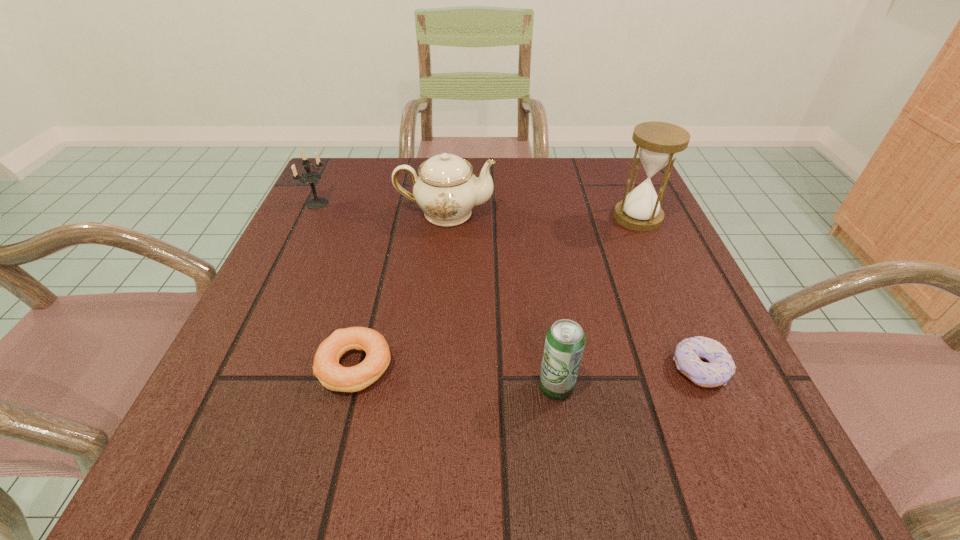
Identify the location of free space that satisfies the following two spatial constraints: 1. on the back side of the hourglass; 2. on the right side of the doughnut. This screenshot has height=540, width=960. (634, 217).

You are a GUI agent. You are given a task and a screenshot of the screen. Output one action in this format:
    pyautogui.click(x=<x>, y=<y>)
    Task: Click on the blank area in the image that satisfies the following two spatial constraints: 1. on the front side of the candle holder; 2. on the right side of the hourglass
    Image resolution: width=960 pixels, height=540 pixels.
    Given the screenshot: What is the action you would take?
    pyautogui.click(x=311, y=217)

Identify the location of vacant space that satisfies the following two spatial constraints: 1. at the spout of the chinaware; 2. on the right side of the tallest object. The width and height of the screenshot is (960, 540). (445, 217).

This screenshot has width=960, height=540. Identify the location of vacant region that satisfies the following two spatial constraints: 1. on the front side of the candle holder; 2. on the right side of the bagel. (240, 366).

You are a GUI agent. You are given a task and a screenshot of the screen. Output one action in this format:
    pyautogui.click(x=<x>, y=<y>)
    Task: Click on the free spot that satisfies the following two spatial constraints: 1. at the spout of the chinaware; 2. on the right side of the hourglass
    
    Given the screenshot: What is the action you would take?
    [x=445, y=217]

Identify the location of vacant point that satisfies the following two spatial constraints: 1. on the front side of the leftmost object; 2. on the left side of the third object from right to left. (229, 387).